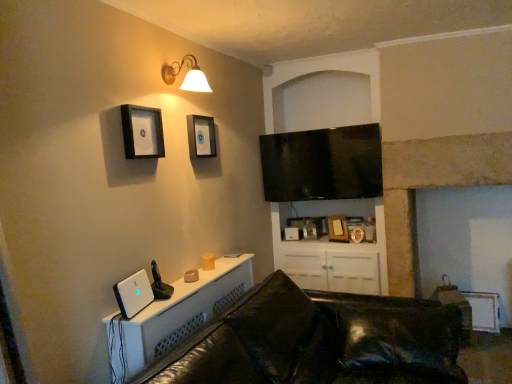
I want to click on gold metallic picture frame at upper center, the 1th picture frame positioned from the bottom, so click(356, 233).

Describe the element at coordinates (318, 341) in the screenshot. Image resolution: width=512 pixels, height=384 pixels. I see `black leather couch at lower center` at that location.

What is the approximate width of black leather couch at lower center?

black leather couch at lower center is 1.19 meters in width.

In order to click on white glossy cabinet at lower center in this screenshot , I will do `click(174, 317)`.

What is the approximate width of wooden picture frame at center, the 4th picture frame in the front-to-back sequence?

wooden picture frame at center, the 4th picture frame in the front-to-back sequence, is 7.19 centimeters wide.

The width and height of the screenshot is (512, 384). Describe the element at coordinates (322, 164) in the screenshot. I see `black glossy flat-screen tv at upper center` at that location.

This screenshot has width=512, height=384. Find the location of `black glossy flat-screen tv at upper center`. black glossy flat-screen tv at upper center is located at coordinates (322, 164).

In order to face matte black picture frame at upper center, which is the fourth picture frame from bottom to top, should I rotate leftwards or rightwards?

Turn left approximately 7.187 degrees to face it.

This screenshot has height=384, width=512. I want to click on gold metallic picture frame at upper center, the 1th picture frame positioned from the bottom, so click(356, 233).

Can you confirm if black leather couch at lower center is thinner than matte gold wall sconce at upper center?

Incorrect, the width of black leather couch at lower center is not less than that of matte gold wall sconce at upper center.

Can you tell me how much black leather couch at lower center and matte gold wall sconce at upper center differ in facing direction?

0.586 degrees separate the facing orientations of black leather couch at lower center and matte gold wall sconce at upper center.

Would you say black leather couch at lower center is to the left or to the right of matte gold wall sconce at upper center in the picture?

In the image, black leather couch at lower center appears on the right side of matte gold wall sconce at upper center.

From the image's perspective, who appears lower, black leather couch at lower center or matte gold wall sconce at upper center?

black leather couch at lower center.

Does wooden picture frame at center, the 3th picture frame positioned from the top, appear on the right side of black glossy flat-screen tv at upper center?

Yes.

Are wooden picture frame at center, the 2th picture frame positioned from the right, and black glossy flat-screen tv at upper center making contact?

No, wooden picture frame at center, the 2th picture frame positioned from the right, is not making contact with black glossy flat-screen tv at upper center.

Which is behind, point (344, 236) or point (367, 163)?

The point (344, 236) is farther from the camera.

From a real-world perspective, is wooden picture frame at center, which ranks as the third picture frame in left-to-right order, physically above black glossy flat-screen tv at upper center?

Actually, wooden picture frame at center, which ranks as the third picture frame in left-to-right order, is physically below black glossy flat-screen tv at upper center in the real world.

Can you tell me how much matte black picture frame at upper center, the third picture frame viewed from the back, and white glossy cabinet at lower center differ in facing direction?

The angular difference between matte black picture frame at upper center, the third picture frame viewed from the back, and white glossy cabinet at lower center is 0.584 degrees.

Is point (209, 136) closer or farther from the camera than point (156, 314)?

Point (209, 136) is positioned farther from the camera compared to point (156, 314).

From the image's perspective, is matte black picture frame at upper center, which is the fourth picture frame from bottom to top, over white glossy cabinet at lower center?

Indeed, from the image's perspective, matte black picture frame at upper center, which is the fourth picture frame from bottom to top, is shown above white glossy cabinet at lower center.

Is matte black picture frame at upper center, the third picture frame when ordered from right to left, smaller than white glossy cabinet at lower center?

Correct, matte black picture frame at upper center, the third picture frame when ordered from right to left, occupies less space than white glossy cabinet at lower center.

From a real-world perspective, is wooden picture frame at center, the 3th picture frame positioned from the top, positioned above or below white plastic desktop computer at lower left?

wooden picture frame at center, the 3th picture frame positioned from the top, is situated lower than white plastic desktop computer at lower left in the real world.

What's the angular difference between wooden picture frame at center, which is the 2th picture frame from bottom to top, and white plastic desktop computer at lower left's facing directions?

The angular difference between wooden picture frame at center, which is the 2th picture frame from bottom to top, and white plastic desktop computer at lower left is 70.8 degrees.

Is wooden picture frame at center, the 2th picture frame positioned from the right, inside or outside of white plastic desktop computer at lower left?

wooden picture frame at center, the 2th picture frame positioned from the right, is spatially situated outside white plastic desktop computer at lower left.

From the white glossy cabinet at lower center, count 1st picture frames backward and point to it. Please provide its 2D coordinates.

[(142, 132)]

Is point (158, 358) farther from viewer compared to point (160, 116)?

No.

Between white glossy cabinet at lower center and black matte picture frame at upper left, placed as the second picture frame when sorted from top to bottom, which one has smaller width?

black matte picture frame at upper left, placed as the second picture frame when sorted from top to bottom.

From their relative heights in the image, would you say white glossy cabinet at lower center is taller or shorter than black matte picture frame at upper left, which appears as the first picture frame when viewed from the left?

In the image, white glossy cabinet at lower center appears to be shorter than black matte picture frame at upper left, which appears as the first picture frame when viewed from the left.

Considering the positions of point (136, 306) and point (215, 153), is point (136, 306) closer or farther from the camera than point (215, 153)?

Point (136, 306) is closer to the camera than point (215, 153).

How far apart are white plastic desktop computer at lower left and matte black picture frame at upper center, which is the fourth picture frame from bottom to top?

3.32 feet.

Can matte black picture frame at upper center, the third picture frame when ordered from right to left, be found inside white plastic desktop computer at lower left?

No, matte black picture frame at upper center, the third picture frame when ordered from right to left, is located outside of white plastic desktop computer at lower left.

Considering the relative sizes of white plastic desktop computer at lower left and matte black picture frame at upper center, placed as the 1th picture frame when sorted from top to bottom, in the image provided, is white plastic desktop computer at lower left thinner than matte black picture frame at upper center, placed as the 1th picture frame when sorted from top to bottom,?

In fact, white plastic desktop computer at lower left might be wider than matte black picture frame at upper center, placed as the 1th picture frame when sorted from top to bottom.

Is white glossy cabinet at lower center a part of black matte picture frame at upper left, the 4th picture frame viewed from the back?

No, white glossy cabinet at lower center is not surrounded by black matte picture frame at upper left, the 4th picture frame viewed from the back.

Considering the relative sizes of black matte picture frame at upper left, the first picture frame positioned from the front, and white glossy cabinet at lower center in the image provided, is black matte picture frame at upper left, the first picture frame positioned from the front, bigger than white glossy cabinet at lower center?

Actually, black matte picture frame at upper left, the first picture frame positioned from the front, might be smaller than white glossy cabinet at lower center.

Is black matte picture frame at upper left, the 4th picture frame viewed from the back, to the left or to the right of white glossy cabinet at lower center in the image?

black matte picture frame at upper left, the 4th picture frame viewed from the back, is positioned on white glossy cabinet at lower center's left side.

Find the location of a particular element. studio couch directly beneath the matte gold wall sconce at upper center (from a real-world perspective) is located at coordinates (318, 341).

Starting from the black glossy flat-screen tv at upper center, which picture frame is the 2nd one behind? Please provide its 2D coordinates.

[(338, 228)]

Considering their positions, is matte black picture frame at upper center, placed as the 1th picture frame when sorted from top to bottom, positioned closer to gold metallic picture frame at upper center, the second picture frame from the back, than black glossy flat-screen tv at upper center?

Based on the image, black glossy flat-screen tv at upper center appears to be nearer to gold metallic picture frame at upper center, the second picture frame from the back.

Based on their spatial positions, is white glossy cabinet at lower center or white plastic desktop computer at lower left closer to black glossy flat-screen tv at upper center?

white glossy cabinet at lower center is positioned closer to the anchor black glossy flat-screen tv at upper center.

Based on their spatial positions, is black leather couch at lower center or wooden picture frame at center, the 3th picture frame positioned from the top, further from black glossy flat-screen tv at upper center?

black leather couch at lower center lies further to black glossy flat-screen tv at upper center than the other object.

Estimate the real-world distances between objects in this image. Which object is closer to black leather couch at lower center, matte black picture frame at upper center, which is the 2th picture frame in front-to-back order, or white glossy cabinet at lower center?

white glossy cabinet at lower center lies closer to black leather couch at lower center than the other object.

Which object lies nearer to the anchor point matte gold wall sconce at upper center, black leather couch at lower center or black glossy flat-screen tv at upper center?

black glossy flat-screen tv at upper center lies closer to matte gold wall sconce at upper center than the other object.

From the image, which object appears to be farther from matte black picture frame at upper center, the third picture frame when ordered from right to left, matte gold wall sconce at upper center or gold metallic picture frame at upper center, the 1th picture frame from the right?

Among the two, gold metallic picture frame at upper center, the 1th picture frame from the right, is located further to matte black picture frame at upper center, the third picture frame when ordered from right to left.

From the image, which object appears to be farther from matte gold wall sconce at upper center, black glossy flat-screen tv at upper center or matte black picture frame at upper center, which is the 2th picture frame in front-to-back order?

Based on the image, black glossy flat-screen tv at upper center appears to be further to matte gold wall sconce at upper center.

Looking at the image, which one is located closer to gold metallic picture frame at upper center, the 1th picture frame positioned from the bottom, black matte picture frame at upper left, the 4th picture frame viewed from the back, or wooden picture frame at center, the 4th picture frame in the front-to-back sequence?

wooden picture frame at center, the 4th picture frame in the front-to-back sequence, lies closer to gold metallic picture frame at upper center, the 1th picture frame positioned from the bottom, than the other object.

Where is `picture frame between black leather couch at lower center and matte black picture frame at upper center, which is the 2th picture frame in front-to-back order, along the z-axis`? The width and height of the screenshot is (512, 384). picture frame between black leather couch at lower center and matte black picture frame at upper center, which is the 2th picture frame in front-to-back order, along the z-axis is located at coordinates (142, 132).

At what (x,y) coordinates should I click in order to perform the action: click on desktop computer between black matte picture frame at upper left, which appears as the first picture frame when viewed from the left, and white glossy cabinet at lower center in the up-down direction. Please return your answer as a coordinate pair (x, y). Looking at the image, I should click on (133, 294).

Where is `picture frame located between black matte picture frame at upper left, the 4th picture frame viewed from the back, and black glossy flat-screen tv at upper center in the depth direction`? The width and height of the screenshot is (512, 384). picture frame located between black matte picture frame at upper left, the 4th picture frame viewed from the back, and black glossy flat-screen tv at upper center in the depth direction is located at coordinates (204, 136).

Identify the location of television between black matte picture frame at upper left, which appears as the first picture frame when viewed from the left, and wooden picture frame at center, the 4th picture frame in the front-to-back sequence, from front to back. This screenshot has height=384, width=512. (322, 164).